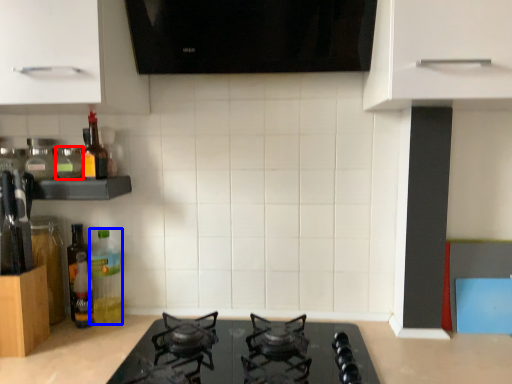
Question: Which of the following is the closest to the observer, bottle (highlighted by a red box) or bottle (highlighted by a blue box)?

Choices:
 (A) bottle
 (B) bottle

Answer: (A)